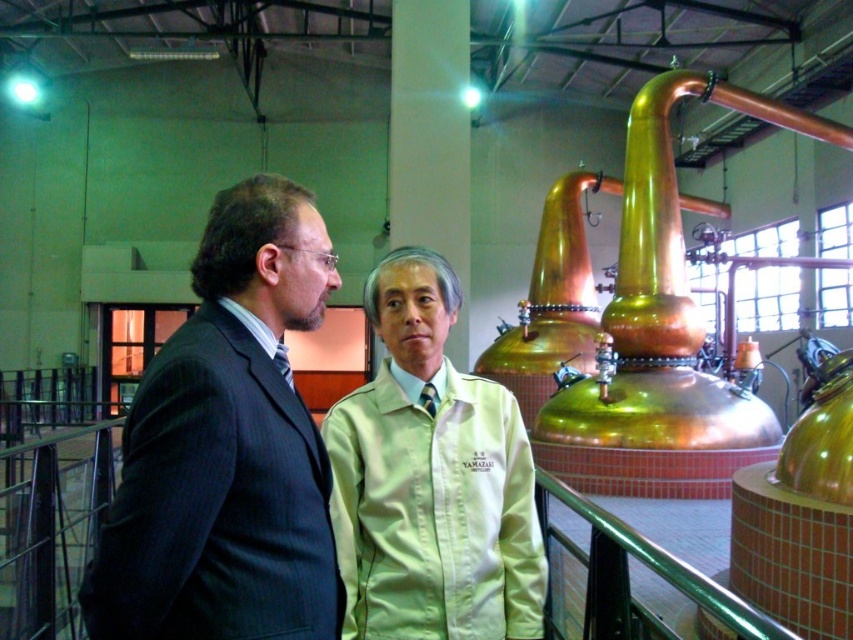
Can you confirm if dark gray pinstripe suit at left is shorter than light beige fabric shirt at center?

Yes, dark gray pinstripe suit at left is shorter than light beige fabric shirt at center.

Between dark gray pinstripe suit at left and light beige fabric shirt at center, which one has more height?

light beige fabric shirt at center is taller.

Describe the element at coordinates (227, 448) in the screenshot. I see `dark gray pinstripe suit at left` at that location.

Find the location of `dark gray pinstripe suit at left`. dark gray pinstripe suit at left is located at coordinates tap(227, 448).